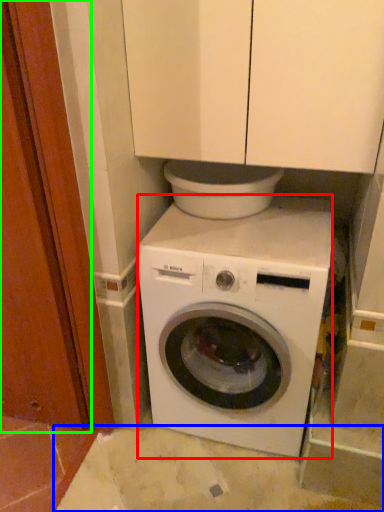
Question: Estimate the real-world distances between objects in this image. Which object is farther from washing machine (highlighted by a red box), concrete (highlighted by a blue box) or screen door (highlighted by a green box)?

Choices:
 (A) concrete
 (B) screen door

Answer: (B)